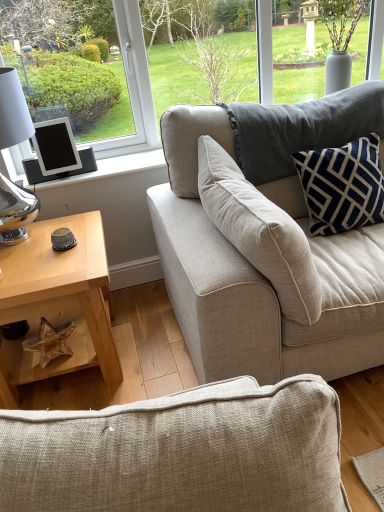
Identify the location of empty space that is ontop of light wood/texture coffee table at lower left (from a real-world perspective). (43, 254).